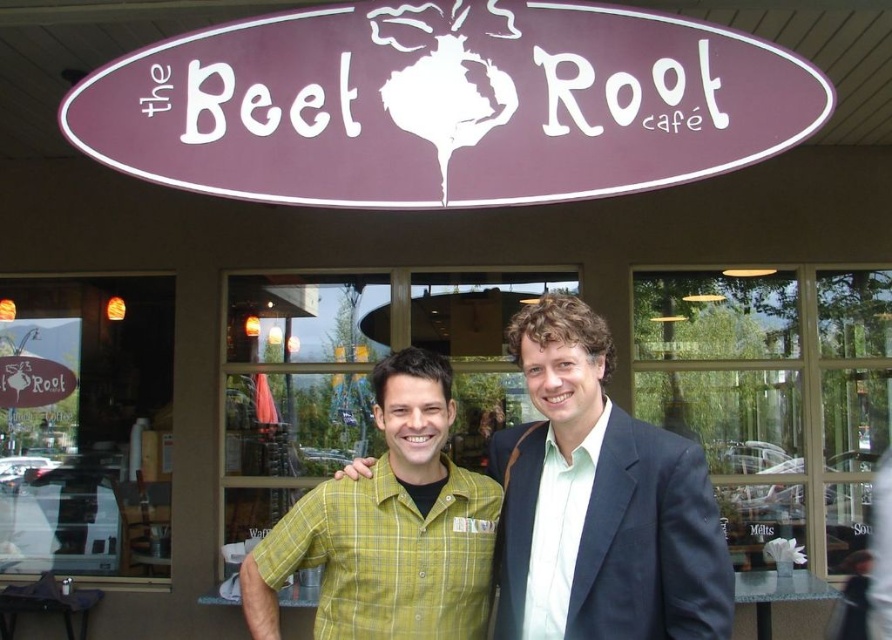
You are a photographer adjusting your camera settings to focus on the dark blue suit at center and the yellow plaid shirt at center. Which of these two items should you focus on first to ensure proper depth of field?

The dark blue suit at center is closer to the viewer than the yellow plaid shirt at center, so you should focus on the dark blue suit at center first to ensure proper depth of field.